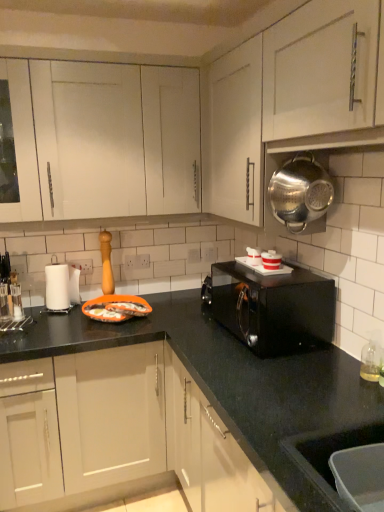
Question: Does point (274, 252) appear closer or farther from the camera than point (44, 276)?

Choices:
 (A) closer
 (B) farther

Answer: (A)

Question: Looking at the image, does white glossy microwave at upper right, marked as the third appliance in a back-to-front arrangement, seem bigger or smaller compared to white paper towel at left, which is counted as the 1th appliance, starting from the left?

Choices:
 (A) small
 (B) big

Answer: (A)

Question: Based on their relative distances, which object is farther from the matte white cabinets at center, arranged as the 1th cabinetry when ordered from the bottom?

Choices:
 (A) white paper towel at left, which is the fourth appliance in top-to-bottom order
 (B) white plastic container at center, the 3th appliance when ordered from front to back
 (C) metallic silver pot at upper right, which is counted as the 2th cabinetry, starting from the bottom
 (D) clear glass bottle at lower right
 (E) metallic silver strainer at upper right, which ranks as the first appliance in top-to-bottom order

Answer: (C)

Question: Based on their relative distances, which object is nearer to the white glossy microwave at upper right, marked as the third appliance in a top-to-bottom arrangement?

Choices:
 (A) clear glass bottle at lower right
 (B) metallic silver strainer at upper right, the first appliance when ordered from front to back
 (C) matte white cabinets at center, the second cabinetry viewed from the top
 (D) white plastic container at center, the 2th appliance viewed from the back
 (E) white paper towel at left, which is the fourth appliance in top-to-bottom order

Answer: (D)